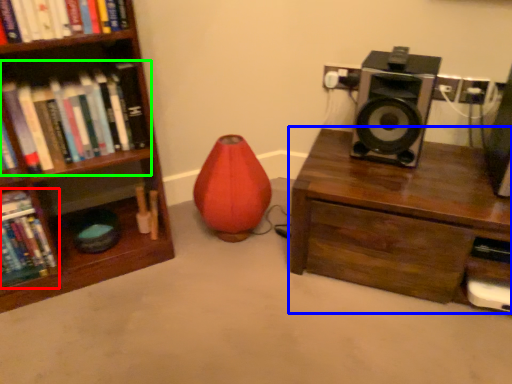
Question: Which object is the farthest from book (highlighted by a red box)? Choose among these: desk (highlighted by a blue box) or book (highlighted by a green box).

Choices:
 (A) desk
 (B) book

Answer: (A)